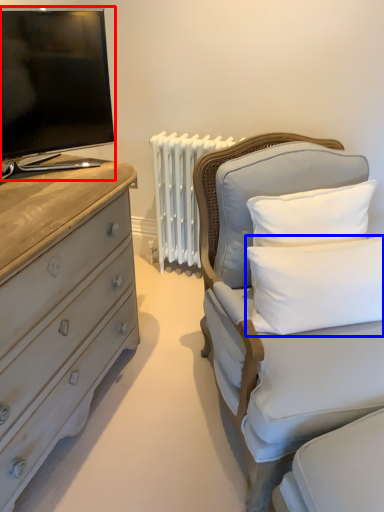
Question: Which object appears farthest to the camera in this image, television (highlighted by a red box) or pillow (highlighted by a blue box)?

Choices:
 (A) television
 (B) pillow

Answer: (B)